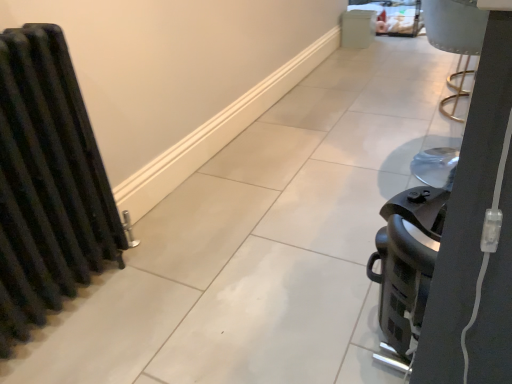
How much space does black plastic coffee maker at right, positioned as the 1th appliance in bottom-to-top order, occupy vertically?

black plastic coffee maker at right, positioned as the 1th appliance in bottom-to-top order, is 16.36 inches in height.

Where is `white matte cabinet at upper center, which ranks as the first appliance in top-to-bottom order`? The height and width of the screenshot is (384, 512). white matte cabinet at upper center, which ranks as the first appliance in top-to-bottom order is located at coordinates (357, 28).

In the image, is white matte cabinet at upper center, the second appliance from the bottom, on the left side or the right side of black plastic coffee maker at right, positioned as the 1th appliance in bottom-to-top order?

Based on their positions, white matte cabinet at upper center, the second appliance from the bottom, is located to the right of black plastic coffee maker at right, positioned as the 1th appliance in bottom-to-top order.

Is white matte cabinet at upper center, arranged as the first appliance when viewed from the back, bigger than black plastic coffee maker at right, positioned as the 1th appliance in bottom-to-top order?

No.

Is white matte cabinet at upper center, the second appliance from the bottom, facing away from black plastic coffee maker at right, the second appliance positioned from the top?

No, black plastic coffee maker at right, the second appliance positioned from the top, is not at the back of white matte cabinet at upper center, the second appliance from the bottom.

How much distance is there between black matte radiator at left and white matte cabinet at upper center, the 2th appliance in the front-to-back sequence?

They are 2.84 meters apart.

From a real-world perspective, who is located higher, black matte radiator at left or white matte cabinet at upper center, which ranks as the first appliance in top-to-bottom order?

From a 3D spatial view, black matte radiator at left is above.

Is black matte radiator at left in front of white matte cabinet at upper center, arranged as the first appliance when viewed from the back?

Yes, black matte radiator at left is in front of white matte cabinet at upper center, arranged as the first appliance when viewed from the back.

Is black matte radiator at left bigger or smaller than white matte cabinet at upper center, the 2th appliance in the front-to-back sequence?

In the image, black matte radiator at left appears to be larger than white matte cabinet at upper center, the 2th appliance in the front-to-back sequence.

What's the angular difference between black plastic coffee maker at right, the second appliance positioned from the top, and black matte radiator at left's facing directions?

179 degrees separate the facing orientations of black plastic coffee maker at right, the second appliance positioned from the top, and black matte radiator at left.

Is point (403, 271) positioned after point (19, 134)?

That is False.

Is black plastic coffee maker at right, positioned as the 1th appliance in bottom-to-top order, facing away from black matte radiator at left?

black plastic coffee maker at right, positioned as the 1th appliance in bottom-to-top order, is not turned away from black matte radiator at left.

Considering the relative positions of black plastic coffee maker at right, which is the 2th appliance in right-to-left order, and black matte radiator at left in the image provided, is black plastic coffee maker at right, which is the 2th appliance in right-to-left order, to the left or to the right of black matte radiator at left?

black plastic coffee maker at right, which is the 2th appliance in right-to-left order, is to the right of black matte radiator at left.

Which is closer, (x=406, y=192) or (x=347, y=34)?

Point (x=406, y=192) is positioned closer to the camera compared to point (x=347, y=34).

Considering the relative positions of black plastic coffee maker at right, positioned as the 1th appliance in bottom-to-top order, and white matte cabinet at upper center, the second appliance from the bottom, in the image provided, is black plastic coffee maker at right, positioned as the 1th appliance in bottom-to-top order, in front of white matte cabinet at upper center, the second appliance from the bottom,?

Yes, black plastic coffee maker at right, positioned as the 1th appliance in bottom-to-top order, is in front of white matte cabinet at upper center, the second appliance from the bottom.

From the image's perspective, which is below, black plastic coffee maker at right, positioned as the 1th appliance in bottom-to-top order, or white matte cabinet at upper center, which ranks as the 2th appliance in left-to-right order?

From the image's view, black plastic coffee maker at right, positioned as the 1th appliance in bottom-to-top order, is below.

Considering the positions of objects black matte radiator at left and black plastic coffee maker at right, marked as the 2th appliance in a back-to-front arrangement, in the image provided, who is in front, black matte radiator at left or black plastic coffee maker at right, marked as the 2th appliance in a back-to-front arrangement,?

black matte radiator at left is closer to the camera.

Image resolution: width=512 pixels, height=384 pixels. I want to click on appliance below the black matte radiator at left (from the image's perspective), so click(x=406, y=268).

What's the angular difference between black matte radiator at left and black plastic coffee maker at right, positioned as the 1th appliance in bottom-to-top order,'s facing directions?

179 degrees separate the facing orientations of black matte radiator at left and black plastic coffee maker at right, positioned as the 1th appliance in bottom-to-top order.

Considering the sizes of objects black matte radiator at left and black plastic coffee maker at right, marked as the 2th appliance in a back-to-front arrangement, in the image provided, who is shorter, black matte radiator at left or black plastic coffee maker at right, marked as the 2th appliance in a back-to-front arrangement,?

black plastic coffee maker at right, marked as the 2th appliance in a back-to-front arrangement.

Are white matte cabinet at upper center, arranged as the first appliance when viewed from the back, and black matte radiator at left far apart?

Yes, white matte cabinet at upper center, arranged as the first appliance when viewed from the back, and black matte radiator at left are located far from each other.

In the image, is white matte cabinet at upper center, the second appliance from the bottom, on the left side or the right side of black matte radiator at left?

From the image, it's evident that white matte cabinet at upper center, the second appliance from the bottom, is to the right of black matte radiator at left.

From a real-world perspective, which object stands above the other?

From a 3D spatial view, black matte radiator at left is above.

Considering the relative sizes of white matte cabinet at upper center, the 2th appliance in the front-to-back sequence, and black matte radiator at left in the image provided, is white matte cabinet at upper center, the 2th appliance in the front-to-back sequence, bigger than black matte radiator at left?

No, white matte cabinet at upper center, the 2th appliance in the front-to-back sequence, is not bigger than black matte radiator at left.

Locate an element on the screen. The width and height of the screenshot is (512, 384). appliance directly beneath the black plastic coffee maker at right, marked as the 2th appliance in a back-to-front arrangement (from a real-world perspective) is located at coordinates (357, 28).

Where is `radiator on the left of white matte cabinet at upper center, arranged as the first appliance when viewed from the back`? radiator on the left of white matte cabinet at upper center, arranged as the first appliance when viewed from the back is located at coordinates (47, 183).

Considering their positions, is black plastic coffee maker at right, which is the 2th appliance in right-to-left order, positioned closer to white matte cabinet at upper center, which ranks as the 2th appliance in left-to-right order, than black matte radiator at left?

black plastic coffee maker at right, which is the 2th appliance in right-to-left order, is positioned closer to the anchor white matte cabinet at upper center, which ranks as the 2th appliance in left-to-right order.

Based on their spatial positions, is black matte radiator at left or white matte cabinet at upper center, which is counted as the first appliance, starting from the right, closer to black plastic coffee maker at right, marked as the 2th appliance in a back-to-front arrangement?

black matte radiator at left lies closer to black plastic coffee maker at right, marked as the 2th appliance in a back-to-front arrangement, than the other object.

Based on their spatial positions, is white matte cabinet at upper center, the second appliance from the bottom, or black matte radiator at left further from black plastic coffee maker at right, marked as the 2th appliance in a back-to-front arrangement?

Among the two, white matte cabinet at upper center, the second appliance from the bottom, is located further to black plastic coffee maker at right, marked as the 2th appliance in a back-to-front arrangement.

Which object lies nearer to the anchor point white matte cabinet at upper center, the second appliance from the bottom, black matte radiator at left or black plastic coffee maker at right, positioned as the 1th appliance in bottom-to-top order?

black plastic coffee maker at right, positioned as the 1th appliance in bottom-to-top order, lies closer to white matte cabinet at upper center, the second appliance from the bottom, than the other object.

From the picture: Considering their positions, is black plastic coffee maker at right, which is the 2th appliance in right-to-left order, positioned closer to black matte radiator at left than white matte cabinet at upper center, arranged as the first appliance when viewed from the back?

Among the two, black plastic coffee maker at right, which is the 2th appliance in right-to-left order, is located nearer to black matte radiator at left.

From the image, which object appears to be farther from black matte radiator at left, white matte cabinet at upper center, arranged as the first appliance when viewed from the back, or black plastic coffee maker at right, positioned as the 1th appliance in bottom-to-top order?

white matte cabinet at upper center, arranged as the first appliance when viewed from the back, is positioned further to the anchor black matte radiator at left.

Find the location of a particular element. This screenshot has width=512, height=384. appliance positioned between black matte radiator at left and white matte cabinet at upper center, the second appliance from the bottom, from near to far is located at coordinates (406, 268).